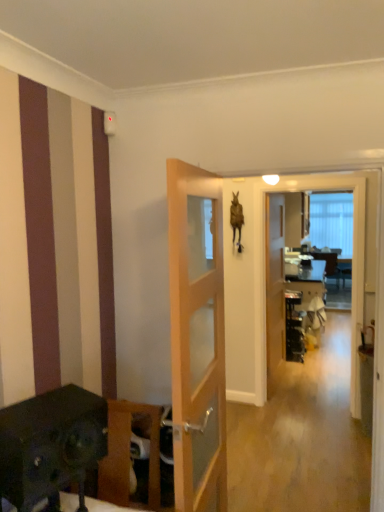
This screenshot has width=384, height=512. Identify the location of vacant region in front of wooden door at center, positioned as the 2th door in front-to-back order. (296, 392).